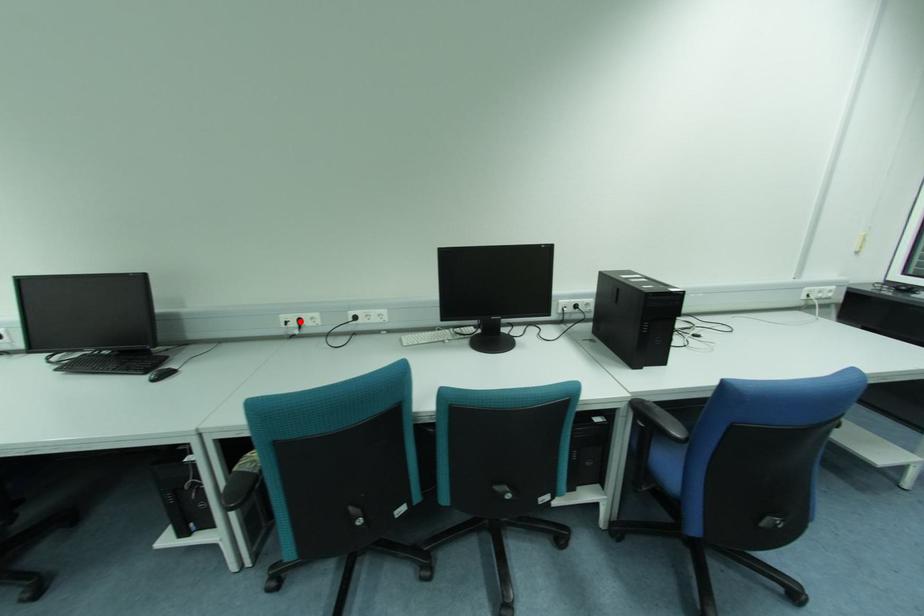
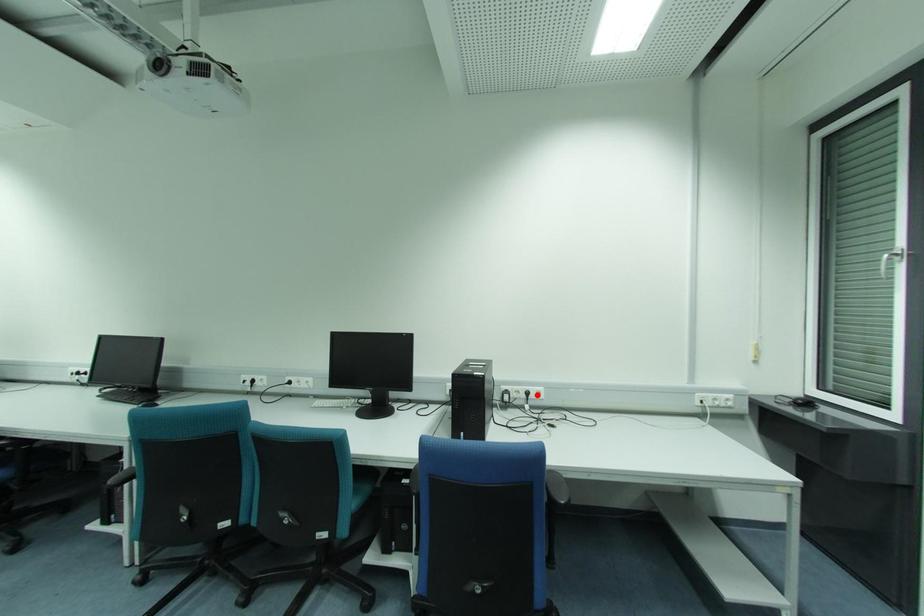
I am providing you with two images of the same scene from different viewpoints. A red point is marked on the first image and another point is marked on the second image. Does the point marked in image1 correspond to the same location as the one in image2?

No